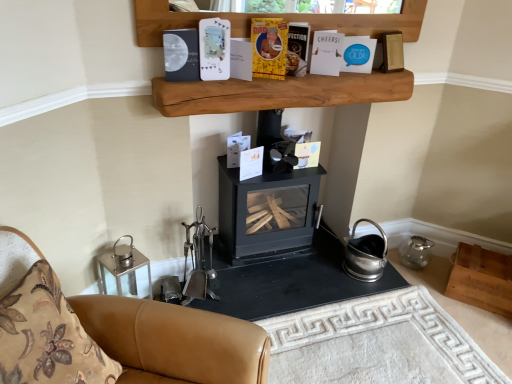
Identify the location of free space that is to the left of wooden box at lower right, which appears as the 1th shelf when viewed from the right. (431, 286).